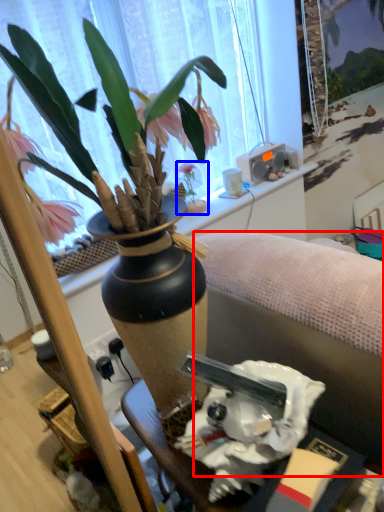
Question: Which object appears farthest to the camera in this image, studio couch (highlighted by a red box) or houseplant (highlighted by a blue box)?

Choices:
 (A) studio couch
 (B) houseplant

Answer: (B)